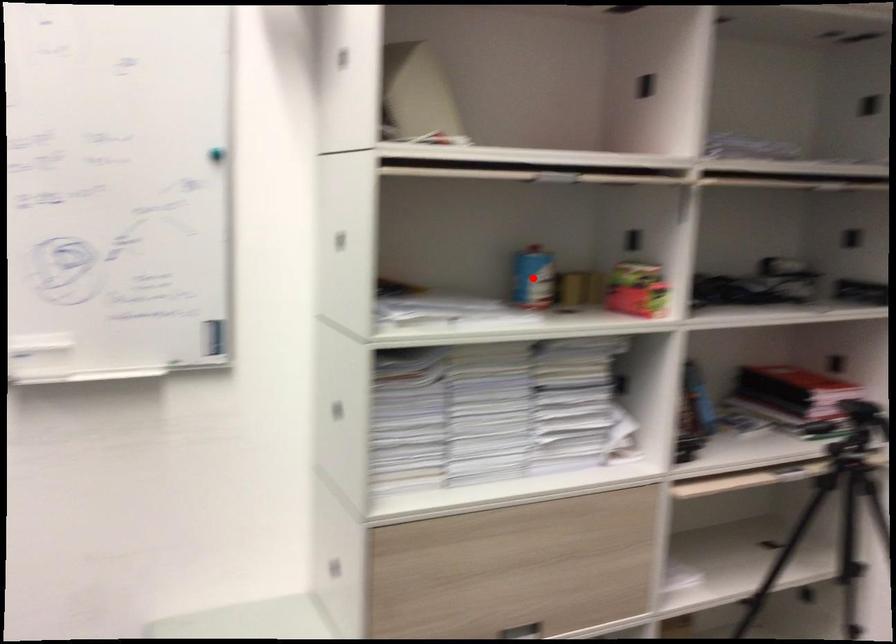
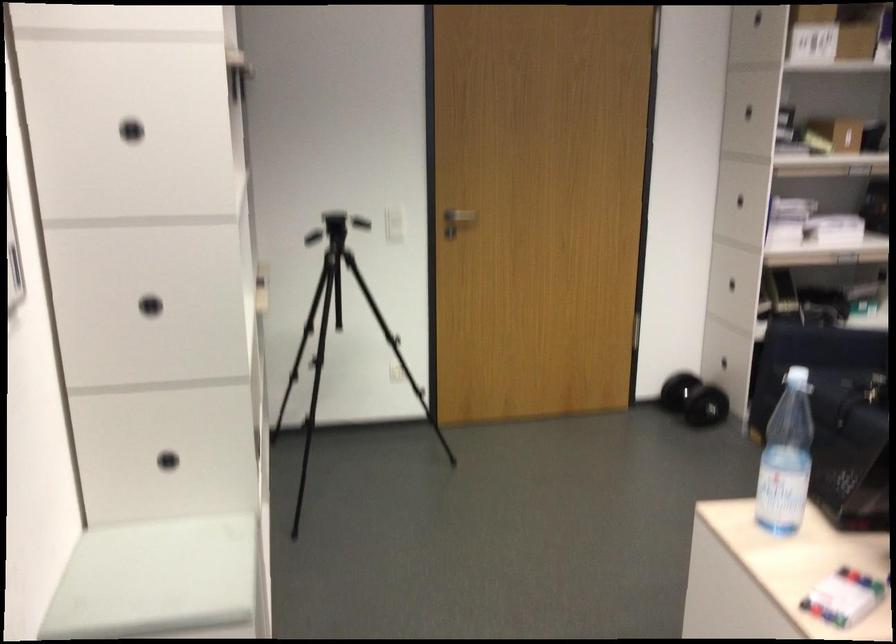
Question: I am providing you with two images of the same scene from different viewpoints. A red point is marked on the first image. Is the red point's position out of view in image 2?

Choices:
 (A) Yes
 (B) No

Answer: (A)